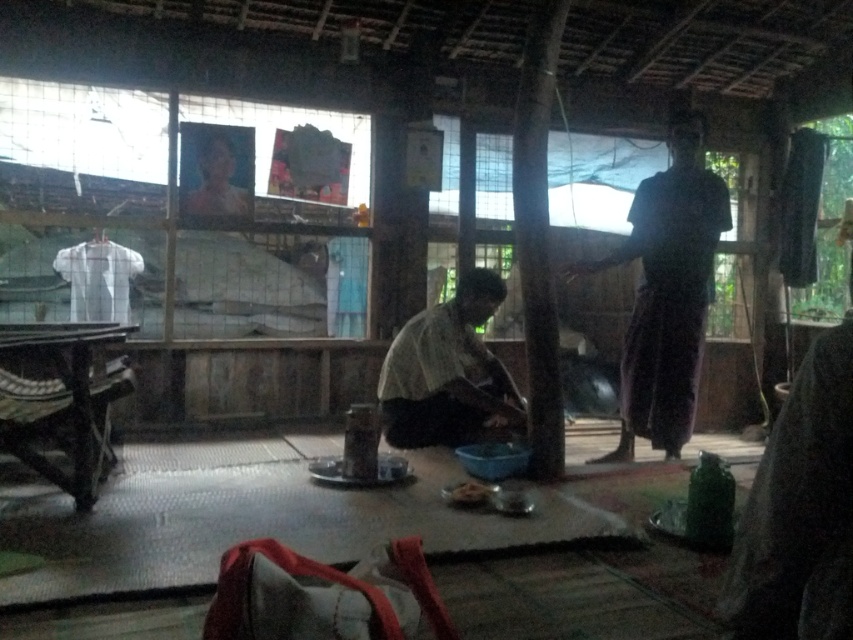
You are observing the scene and need to determine the spatial relationship between the dark brown fabric at right and the matte white shirt at center. Which object is positioned higher in the image?

The dark brown fabric at right is positioned higher than the matte white shirt at center.